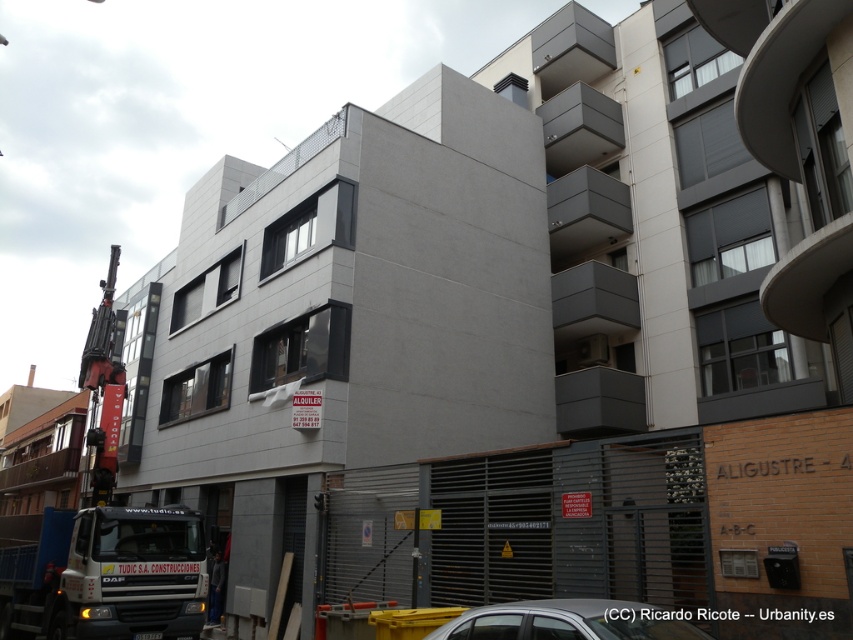
Does metallic silver car at lower center appear on the left side of metallic red crane at left?

No, metallic silver car at lower center is not to the left of metallic red crane at left.

Which of these two, metallic silver car at lower center or metallic red crane at left, stands taller?

With more height is metallic red crane at left.

Identify the location of metallic silver car at lower center. (567, 621).

You are a GUI agent. You are given a task and a screenshot of the screen. Output one action in this format:
    pyautogui.click(x=<x>, y=<y>)
    Task: Click on the metallic silver car at lower center
    The width and height of the screenshot is (853, 640).
    Given the screenshot: What is the action you would take?
    pyautogui.click(x=567, y=621)